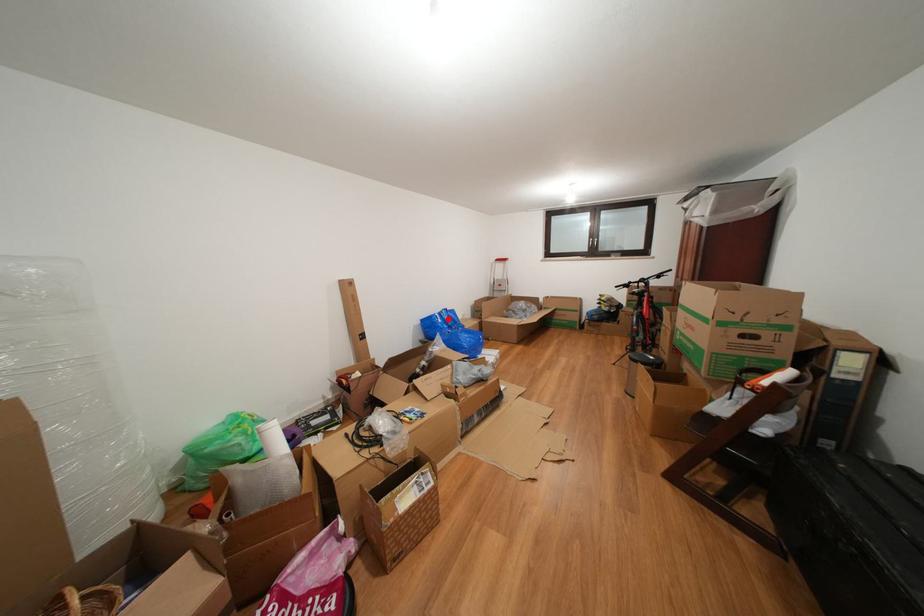
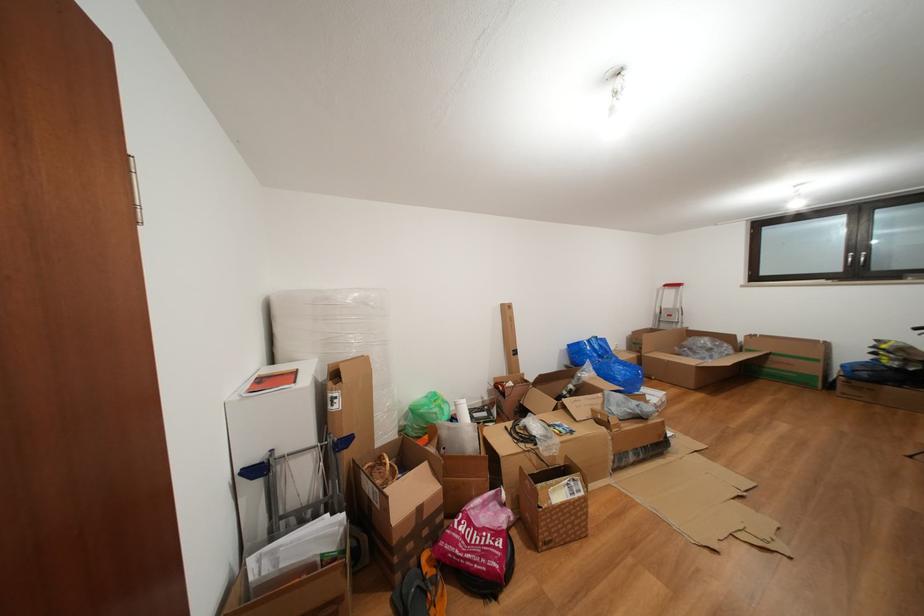
In the second image, find the point that corresponds to the highlighted location in the first image.

(597, 346)